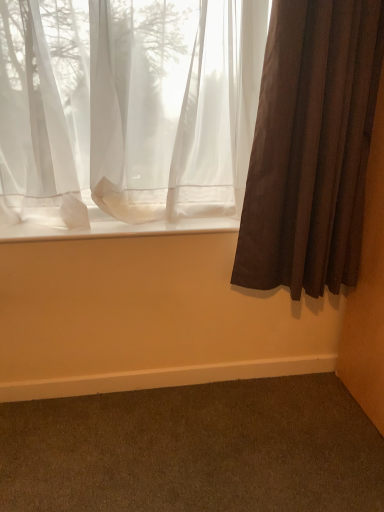
Question: Can you confirm if brown textured curtain at right, which is the first curtain from right to left, is thinner than dark brown carpet at lower right?

Choices:
 (A) yes
 (B) no

Answer: (A)

Question: Considering the relative sizes of brown textured curtain at right, which is the first curtain from right to left, and dark brown carpet at lower right in the image provided, is brown textured curtain at right, which is the first curtain from right to left, bigger than dark brown carpet at lower right?

Choices:
 (A) yes
 (B) no

Answer: (A)

Question: From a real-world perspective, is brown textured curtain at right, which is the first curtain from right to left, below dark brown carpet at lower right?

Choices:
 (A) yes
 (B) no

Answer: (B)

Question: From the image's perspective, is brown textured curtain at right, the 2th curtain positioned from the left, located beneath dark brown carpet at lower right?

Choices:
 (A) yes
 (B) no

Answer: (B)

Question: From the image's perspective, does brown textured curtain at right, the 2th curtain positioned from the left, appear higher than dark brown carpet at lower right?

Choices:
 (A) no
 (B) yes

Answer: (B)

Question: Is brown textured curtain at right, which is the first curtain from right to left, to the left of dark brown carpet at lower right from the viewer's perspective?

Choices:
 (A) yes
 (B) no

Answer: (B)

Question: Does dark brown carpet at lower right have a larger size compared to sheer white curtain at upper left, positioned as the 2th curtain in right-to-left order?

Choices:
 (A) yes
 (B) no

Answer: (B)

Question: Can you confirm if dark brown carpet at lower right is wider than sheer white curtain at upper left, the 1th curtain in the left-to-right sequence?

Choices:
 (A) yes
 (B) no

Answer: (A)

Question: Considering the relative sizes of dark brown carpet at lower right and sheer white curtain at upper left, the 1th curtain in the left-to-right sequence, in the image provided, is dark brown carpet at lower right smaller than sheer white curtain at upper left, the 1th curtain in the left-to-right sequence,?

Choices:
 (A) yes
 (B) no

Answer: (A)

Question: Is dark brown carpet at lower right not within sheer white curtain at upper left, the 1th curtain in the left-to-right sequence?

Choices:
 (A) yes
 (B) no

Answer: (A)

Question: From a real-world perspective, is dark brown carpet at lower right on top of sheer white curtain at upper left, the 1th curtain in the left-to-right sequence?

Choices:
 (A) yes
 (B) no

Answer: (B)

Question: Does dark brown carpet at lower right have a greater height compared to sheer white curtain at upper left, the 1th curtain in the left-to-right sequence?

Choices:
 (A) no
 (B) yes

Answer: (A)

Question: Could you tell me if white sheer fabric at lower center is facing sheer white curtain at upper left, the 1th curtain in the left-to-right sequence?

Choices:
 (A) no
 (B) yes

Answer: (A)